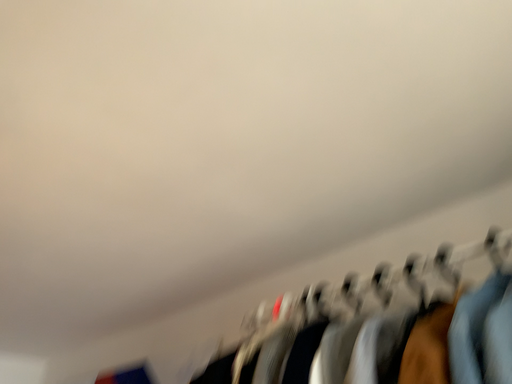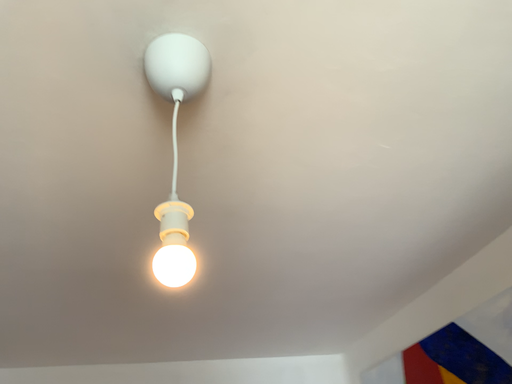
Question: Which way did the camera rotate in the video?

Choices:
 (A) rotated right
 (B) rotated left

Answer: (B)